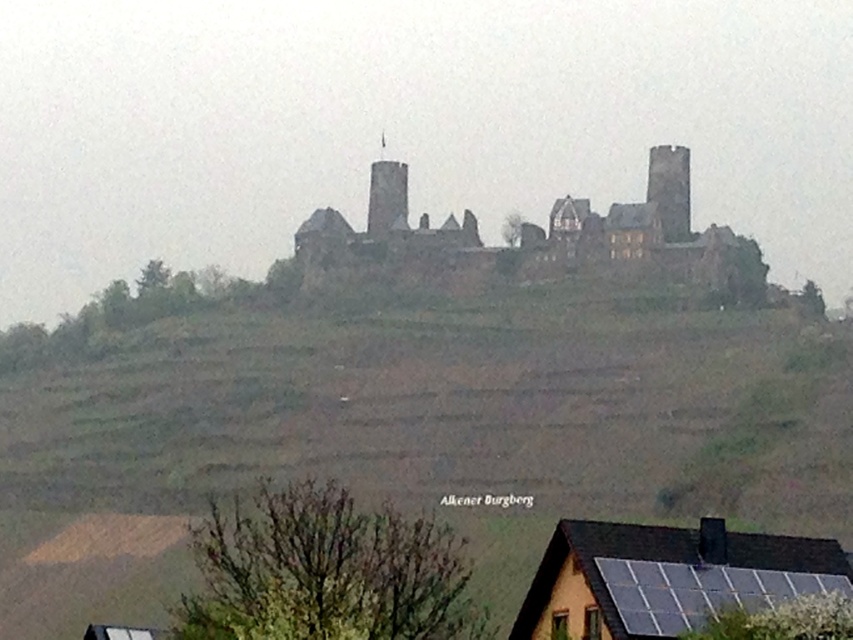
You are a drone operator trying to capture a photo of the brown stone castle at center and the black solar panels at lower right. From your current position, which object is higher in the frame?

The brown stone castle at center is above the black solar panels at lower right, so it is higher in the frame.

You are standing at the base of the hill where the castle is located. You want to reach the green grassy hillside at upper center to take a closer look at the castle. Given that the hillside is 121.62 meters away, can you estimate how long it would take you to walk there at a normal pace?

The green grassy hillside at upper center is 121.62 meters away from the viewer. At a normal walking pace of approximately 1.4 meters per second, it would take roughly 87 seconds, or about 1 minute and 27 seconds, to reach the hillside.

Looking at this image, you are a drone operator planning to fly a drone from the green grassy hillside at upper center to the brown stone castle at center. The drone has a maximum flight range of 25 meters. Can the drone safely reach the castle from the hillside?

The green grassy hillside at upper center is 25.17 meters from the brown stone castle at center. Since the distance is slightly over the drone maximum flight range of 25 meters, the drone cannot safely reach the castle from the hillside.